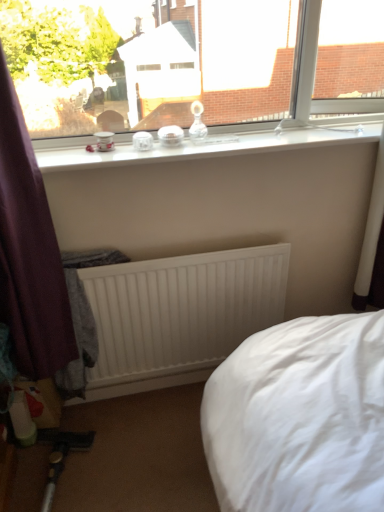
Where is `free area below transparent glass window at upper center (from a real-world perspective)`? The width and height of the screenshot is (384, 512). free area below transparent glass window at upper center (from a real-world perspective) is located at coordinates (268, 134).